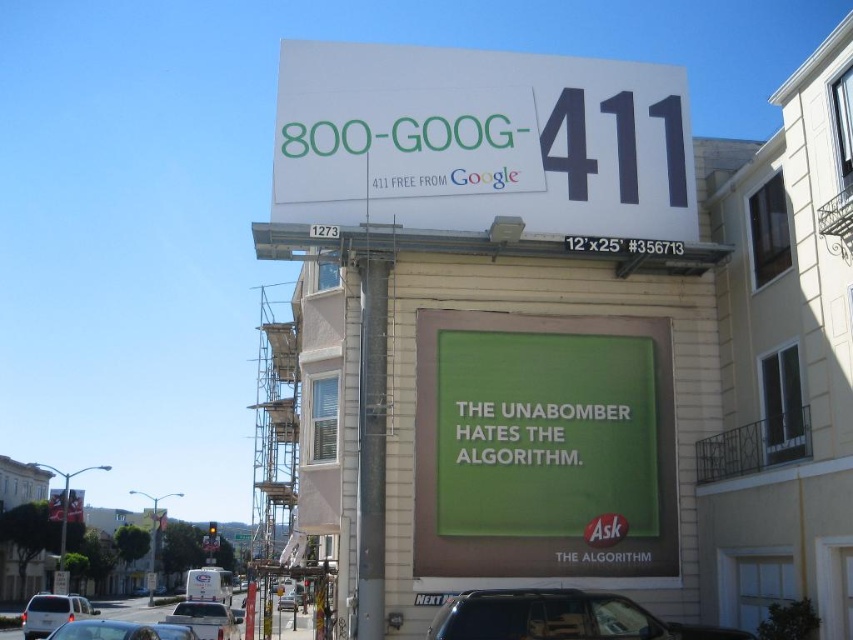
Question: Is green matte sign at upper center wider than silver metallic sedan at center?

Choices:
 (A) no
 (B) yes

Answer: (B)

Question: Which of the following is the closest to the observer?

Choices:
 (A) silver metallic pickup truck at center
 (B) silver metallic van at lower left
 (C) matte black suv at lower center

Answer: (C)

Question: Can you confirm if silver metallic van at lower left is wider than silver metallic pickup truck at center?

Choices:
 (A) yes
 (B) no

Answer: (A)

Question: Among these points, which one is nearest to the camera?

Choices:
 (A) (125, 634)
 (B) (183, 602)
 (C) (68, 513)

Answer: (A)

Question: Can you confirm if white paper billboard at upper center is positioned to the right of matte black suv at lower center?

Choices:
 (A) yes
 (B) no

Answer: (B)

Question: Based on their relative distances, which object is farther from the silver metallic pickup truck at center?

Choices:
 (A) green matte sign at upper center
 (B) silver metallic sedan at center
 (C) metallic silver car at lower left

Answer: (A)